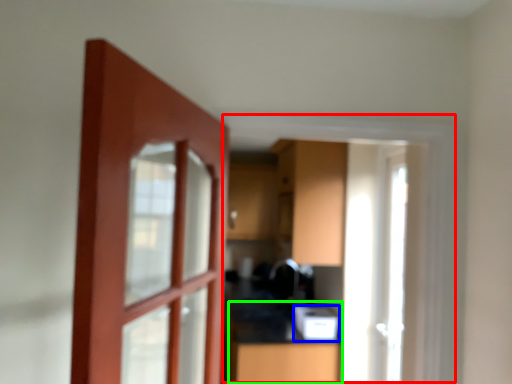
Question: Considering the real-world distances, which object is closest to window frame (highlighted by a red box)? appliance (highlighted by a blue box) or counter (highlighted by a green box).

Choices:
 (A) appliance
 (B) counter

Answer: (A)